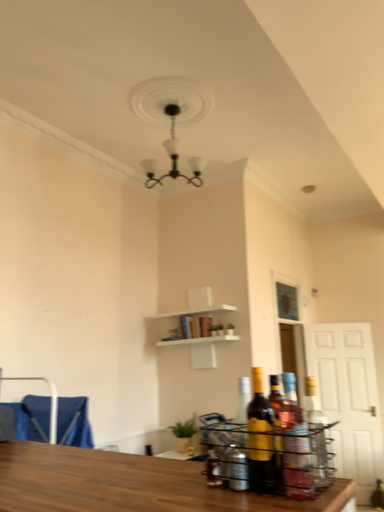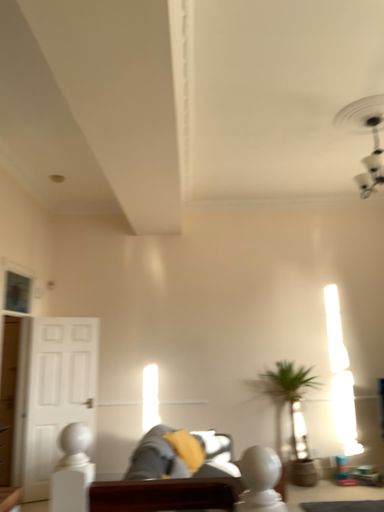
Question: How did the camera likely rotate when shooting the video?

Choices:
 (A) rotated right
 (B) rotated left

Answer: (A)